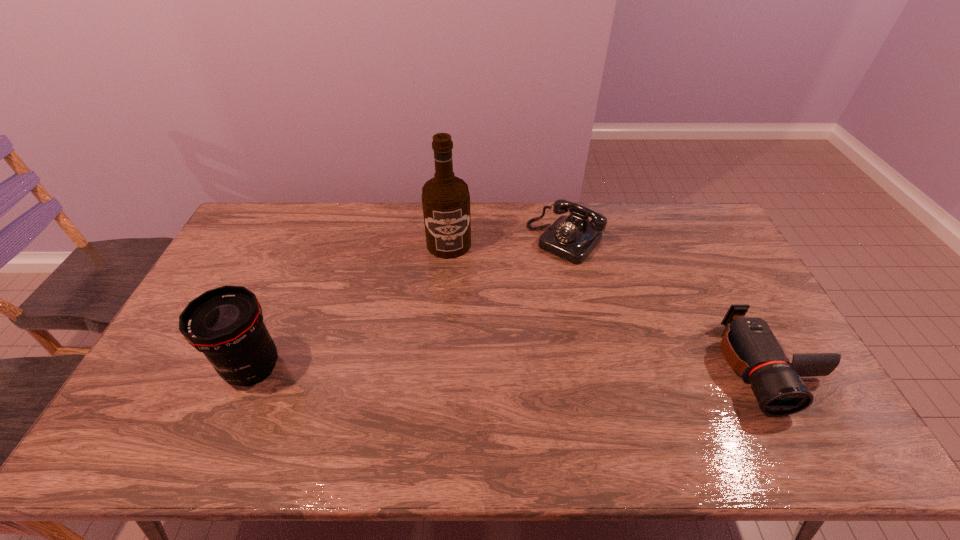
Identify the location of free space located on the dial of the telephone. Image resolution: width=960 pixels, height=540 pixels. (532, 275).

Image resolution: width=960 pixels, height=540 pixels. Identify the location of free space located 0.330m on the label of the tallest object. (458, 335).

Identify the location of blank space located on the label of the tallest object. (459, 341).

At what (x,y) coordinates should I click in order to perform the action: click on vacant region located on the label of the tallest object. Please return your answer as a coordinate pair (x, y). Looking at the image, I should click on (459, 347).

You are a GUI agent. You are given a task and a screenshot of the screen. Output one action in this format:
    pyautogui.click(x=<x>, y=<y>)
    Task: Click on the telephone that is at the far edge
    The height and width of the screenshot is (540, 960).
    Given the screenshot: What is the action you would take?
    pyautogui.click(x=572, y=238)

This screenshot has width=960, height=540. I want to click on alcohol located at the far edge, so click(x=445, y=198).

Where is `telephoto lens that is at the near edge`? The image size is (960, 540). telephoto lens that is at the near edge is located at coordinates (226, 323).

Identify the location of camcorder situated at the near edge. Image resolution: width=960 pixels, height=540 pixels. (749, 346).

Image resolution: width=960 pixels, height=540 pixels. Identify the location of object that is at the right edge. (749, 346).

Where is `object that is positioned at the near right corner`? The width and height of the screenshot is (960, 540). object that is positioned at the near right corner is located at coordinates (749, 346).